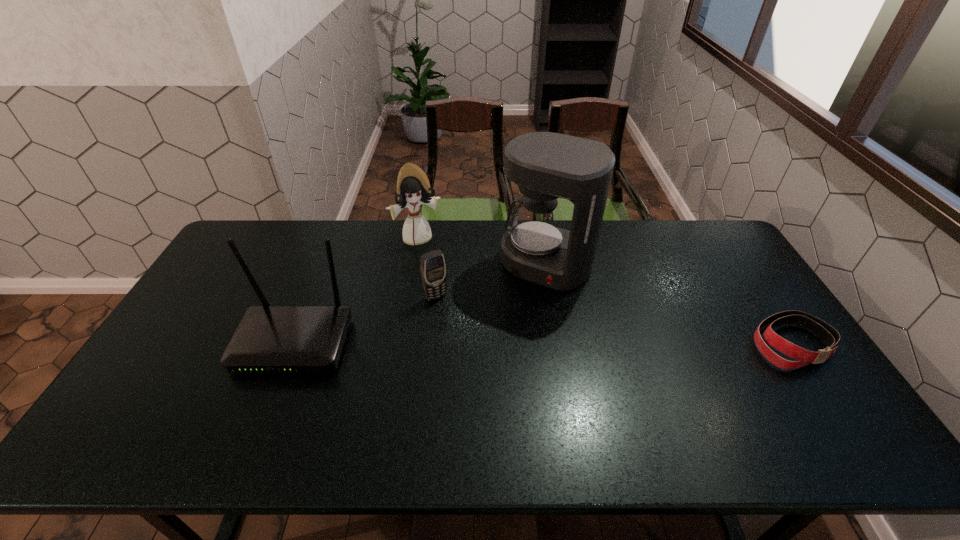
Where is `free space on the desktop that is between the leftmost object and the rightmost object and is positioned on the front-facing side of the coffee maker`? The width and height of the screenshot is (960, 540). free space on the desktop that is between the leftmost object and the rightmost object and is positioned on the front-facing side of the coffee maker is located at coordinates (498, 343).

I want to click on vacant space on the desktop that is between the leftmost object and the dog collar and is positioned on the front face of the cellular telephone, so click(469, 343).

What are the coordinates of `vacant spot on the desktop that is between the router and the shortest object and is positioned at the front face of the doll` in the screenshot? It's located at coord(468,343).